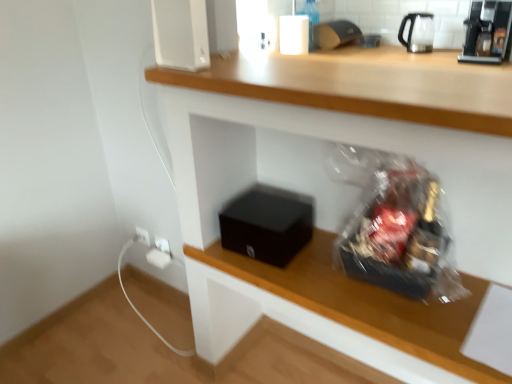
Question: From a real-world perspective, is black matte box at lower center under transparent glass tea pot at upper right?

Choices:
 (A) no
 (B) yes

Answer: (B)

Question: Is black matte box at lower center oriented towards transparent glass tea pot at upper right?

Choices:
 (A) no
 (B) yes

Answer: (A)

Question: From the image's perspective, is black matte box at lower center over transparent glass tea pot at upper right?

Choices:
 (A) yes
 (B) no

Answer: (B)

Question: From a real-world perspective, is black matte box at lower center located higher than transparent glass tea pot at upper right?

Choices:
 (A) yes
 (B) no

Answer: (B)

Question: Would you consider black matte box at lower center to be distant from transparent glass tea pot at upper right?

Choices:
 (A) yes
 (B) no

Answer: (A)

Question: From a real-world perspective, is black matte box at lower center positioned above or below white plastic electric outlet at lower left?

Choices:
 (A) above
 (B) below

Answer: (A)

Question: In terms of height, does black matte box at lower center look taller or shorter compared to white plastic electric outlet at lower left?

Choices:
 (A) short
 (B) tall

Answer: (B)

Question: Considering the relative positions of black matte box at lower center and white plastic electric outlet at lower left in the image provided, is black matte box at lower center to the left or to the right of white plastic electric outlet at lower left?

Choices:
 (A) left
 (B) right

Answer: (B)

Question: Considering the positions of black matte box at lower center and white plastic electric outlet at lower left in the image, is black matte box at lower center wider or thinner than white plastic electric outlet at lower left?

Choices:
 (A) thin
 (B) wide

Answer: (B)

Question: Would you say black matte box at lower center is inside or outside clear glass bottle at upper center?

Choices:
 (A) inside
 (B) outside

Answer: (B)

Question: From the image's perspective, is black matte box at lower center located above or below clear glass bottle at upper center?

Choices:
 (A) below
 (B) above

Answer: (A)

Question: Based on their sizes in the image, would you say black matte box at lower center is bigger or smaller than clear glass bottle at upper center?

Choices:
 (A) small
 (B) big

Answer: (B)

Question: Is point (501, 200) positioned closer to the camera than point (310, 8)?

Choices:
 (A) farther
 (B) closer

Answer: (B)

Question: From a real-world perspective, is black plastic coffee machine at upper right above or below transparent glass tea pot at upper right?

Choices:
 (A) below
 (B) above

Answer: (B)

Question: Is black plastic coffee machine at upper right in front of or behind transparent glass tea pot at upper right in the image?

Choices:
 (A) behind
 (B) front

Answer: (B)